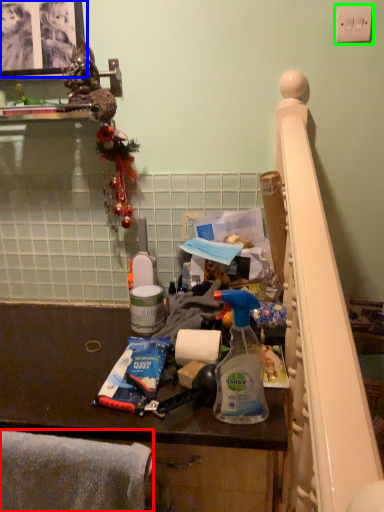
Question: Estimate the real-world distances between objects in this image. Which object is farther from blanket (highlighted by a red box), picture frame (highlighted by a blue box) or light switch (highlighted by a green box)?

Choices:
 (A) picture frame
 (B) light switch

Answer: (B)